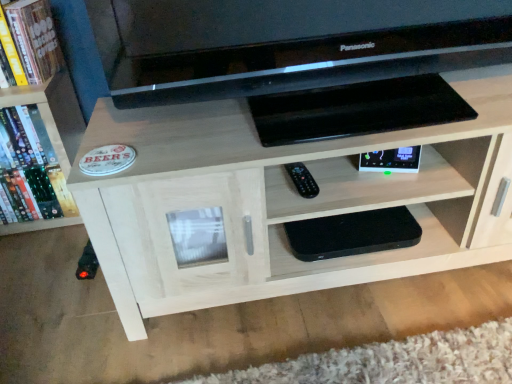
Describe the element at coordinates (31, 39) in the screenshot. I see `hardcover book at upper left` at that location.

Where is `black glossy tv at upper center`? This screenshot has width=512, height=384. black glossy tv at upper center is located at coordinates (288, 44).

You are a GUI agent. You are given a task and a screenshot of the screen. Output one action in this format:
    pyautogui.click(x=<x>, y=<y>)
    Task: Click on the black plastic remote at center
    The image size is (512, 384).
    Given the screenshot: What is the action you would take?
    pyautogui.click(x=302, y=180)

Considering the points (35, 23) and (302, 65), which point is in front, point (35, 23) or point (302, 65)?

The point (302, 65) is more forward.

Where is `book lying above the black glossy tv at upper center (from the image's perspective)`? The image size is (512, 384). book lying above the black glossy tv at upper center (from the image's perspective) is located at coordinates (31, 39).

Consider the image. Is hardcover book at upper left looking in the opposite direction of black glossy tv at upper center?

hardcover book at upper left is not turned away from black glossy tv at upper center.

Which object is positioned more to the right, hardcover book at upper left or black glossy tv at upper center?

black glossy tv at upper center.

Could you tell me if hardcover book at upper left is turned towards wooden bookshelf at left?

No, hardcover book at upper left is not aimed at wooden bookshelf at left.

Is hardcover book at upper left placed right next to wooden bookshelf at left?

They are not placed beside each other.

Considering the sizes of objects hardcover book at upper left and wooden bookshelf at left in the image provided, who is shorter, hardcover book at upper left or wooden bookshelf at left?

hardcover book at upper left.

Considering the sizes of black plastic remote at center and black glossy tv at upper center in the image, is black plastic remote at center wider or thinner than black glossy tv at upper center?

Considering their sizes, black plastic remote at center looks slimmer than black glossy tv at upper center.

Between black plastic remote at center and black glossy tv at upper center, which one is positioned in front?

black glossy tv at upper center is more forward.

Does point (294, 184) come behind point (461, 54)?

Yes, it is behind point (461, 54).

Is black glossy tv at upper center at the back of black plastic remote at center?

No, black glossy tv at upper center is not at the back of black plastic remote at center.

Looking at this image, which is more to the right, hardcover book at upper left or black matte speaker at lower center, the 2th shelf in the top-to-bottom sequence?

From the viewer's perspective, black matte speaker at lower center, the 2th shelf in the top-to-bottom sequence, appears more on the right side.

From the image's perspective, starting from the hardcover book at upper left, which shelf is the 2nd one below? Please provide its 2D coordinates.

[(362, 254)]

In terms of height, does hardcover book at upper left look taller or shorter compared to black matte speaker at lower center, the 2th shelf in the top-to-bottom sequence?

Considering their sizes, hardcover book at upper left has more height than black matte speaker at lower center, the 2th shelf in the top-to-bottom sequence.

Considering their positions, is hardcover book at upper left located in front of or behind black matte speaker at lower center, the 2th shelf in the top-to-bottom sequence?

In the image, hardcover book at upper left appears behind black matte speaker at lower center, the 2th shelf in the top-to-bottom sequence.

From a real-world perspective, is light wood shelf at center, the 1th shelf viewed from the top, under wooden bookshelf at left?

Yes, from a real-world perspective, light wood shelf at center, the 1th shelf viewed from the top, is under wooden bookshelf at left.

From the picture: How many degrees apart are the facing directions of light wood shelf at center, the 1th shelf viewed from the top, and wooden bookshelf at left?

The angular difference between light wood shelf at center, the 1th shelf viewed from the top, and wooden bookshelf at left is 0.927 degrees.

Which of these two, light wood shelf at center, the 1th shelf viewed from the top, or wooden bookshelf at left, stands taller?

light wood shelf at center, the 1th shelf viewed from the top.

From a real-world perspective, is black glossy tv at upper center positioned under wooden bookshelf at left based on gravity?

No.

Is black glossy tv at upper center to the right of wooden bookshelf at left from the viewer's perspective?

Correct, you'll find black glossy tv at upper center to the right of wooden bookshelf at left.

Is black glossy tv at upper center shorter than wooden bookshelf at left?

Indeed, black glossy tv at upper center has a lesser height compared to wooden bookshelf at left.

Is there a large distance between light wood shelf at center, the 1th shelf viewed from the top, and black matte speaker at lower center, the 2th shelf in the top-to-bottom sequence?

That's not correct — light wood shelf at center, the 1th shelf viewed from the top, is a little close to black matte speaker at lower center, the 2th shelf in the top-to-bottom sequence.

From a real-world perspective, between light wood shelf at center, acting as the 2th shelf starting from the bottom, and black matte speaker at lower center, the 2th shelf in the top-to-bottom sequence, who is vertically lower?

In real-world perspective, black matte speaker at lower center, the 2th shelf in the top-to-bottom sequence, is lower.

This screenshot has width=512, height=384. In order to click on shelf on the left side of black matte speaker at lower center, the 2th shelf in the top-to-bottom sequence in this screenshot , I will do `click(285, 200)`.

At what (x,y) coordinates should I click in order to perform the action: click on computer on the right of hardcover book at upper left. Please return your answer as a coordinate pair (x, y). The height and width of the screenshot is (384, 512). Looking at the image, I should click on (288, 44).

In order to click on bookcase behind the hardcover book at upper left in this screenshot , I will do `click(53, 113)`.

Based on their spatial positions, is hardcover book at upper left or black matte speaker at lower center, which is the first shelf from bottom to top, further from black glossy tv at upper center?

Among the two, hardcover book at upper left is located further to black glossy tv at upper center.

Based on their spatial positions, is black matte speaker at lower center, the 2th shelf in the top-to-bottom sequence, or black glossy tv at upper center closer to wooden bookshelf at left?

black glossy tv at upper center is positioned closer to the anchor wooden bookshelf at left.

From the image, which object appears to be farther from wooden bookshelf at left, hardcover book at upper left or black glossy tv at upper center?

black glossy tv at upper center is further to wooden bookshelf at left.

Looking at the image, which one is located further to black plastic remote at center, hardcover book at upper left or black matte speaker at lower center, the 2th shelf in the top-to-bottom sequence?

hardcover book at upper left.

Estimate the real-world distances between objects in this image. Which object is closer to black glossy tv at upper center, light wood shelf at center, the 1th shelf viewed from the top, or black matte speaker at lower center, which is the first shelf from bottom to top?

light wood shelf at center, the 1th shelf viewed from the top, lies closer to black glossy tv at upper center than the other object.

From the picture: Estimate the real-world distances between objects in this image. Which object is closer to hardcover book at upper left, light wood shelf at center, the 1th shelf viewed from the top, or wooden bookshelf at left?

Among the two, wooden bookshelf at left is located nearer to hardcover book at upper left.

Based on their spatial positions, is wooden bookshelf at left or light wood shelf at center, acting as the 2th shelf starting from the bottom, closer to black matte speaker at lower center, which is the first shelf from bottom to top?

Based on the image, light wood shelf at center, acting as the 2th shelf starting from the bottom, appears to be nearer to black matte speaker at lower center, which is the first shelf from bottom to top.

Looking at the image, which one is located closer to wooden bookshelf at left, black matte speaker at lower center, the 2th shelf in the top-to-bottom sequence, or hardcover book at upper left?

Among the two, hardcover book at upper left is located nearer to wooden bookshelf at left.

You are a GUI agent. You are given a task and a screenshot of the screen. Output one action in this format:
    pyautogui.click(x=<x>, y=<y>)
    Task: Click on the shelf between hardcover book at upper left and black matte speaker at lower center, the 2th shelf in the top-to-bottom sequence, in the horizontal direction
    
    Given the screenshot: What is the action you would take?
    pyautogui.click(x=285, y=200)

At what (x,y) coordinates should I click in order to perform the action: click on computer between wooden bookshelf at left and light wood shelf at center, the 1th shelf viewed from the top, in the horizontal direction. Please return your answer as a coordinate pair (x, y). Image resolution: width=512 pixels, height=384 pixels. Looking at the image, I should click on (288, 44).

Identify the location of remote between black glossy tv at upper center and light wood shelf at center, acting as the 2th shelf starting from the bottom, in the up-down direction. This screenshot has height=384, width=512. (302, 180).

This screenshot has height=384, width=512. Identify the location of remote situated between wooden bookshelf at left and black matte speaker at lower center, which is the first shelf from bottom to top, from left to right. (302, 180).